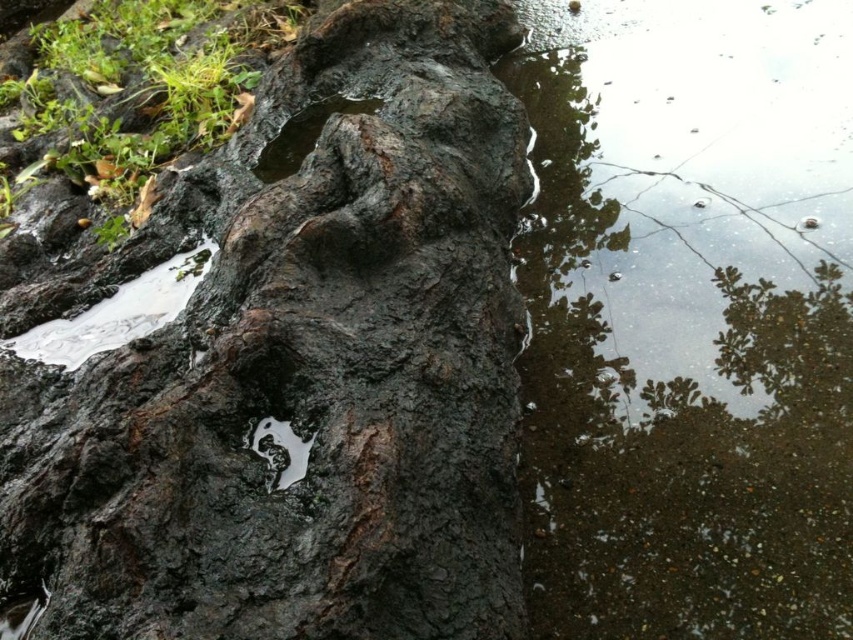
Question: From the image, what is the correct spatial relationship of dark brown rough bark at center in relation to white glossy puddle at center?

Choices:
 (A) right
 (B) left

Answer: (B)

Question: Is dark brown rough bark at center thinner than clear water at lower right?

Choices:
 (A) yes
 (B) no

Answer: (B)

Question: Can you confirm if clear water at lower right is bigger than white glossy puddle at center?

Choices:
 (A) no
 (B) yes

Answer: (B)

Question: Which point is closer to the camera?

Choices:
 (A) (793, 545)
 (B) (289, 508)
 (C) (300, 472)

Answer: (B)

Question: Which object appears farthest from the camera in this image?

Choices:
 (A) clear water at lower right
 (B) white glossy puddle at center

Answer: (A)

Question: Estimate the real-world distances between objects in this image. Which object is farther from the clear water at lower right?

Choices:
 (A) white glossy puddle at center
 (B) dark brown rough bark at center

Answer: (A)